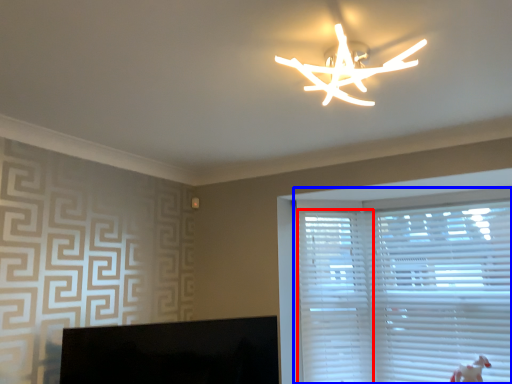
Question: Which point is further to the camera, blind (highlighted by a red box) or window blind (highlighted by a blue box)?

Choices:
 (A) blind
 (B) window blind

Answer: (A)